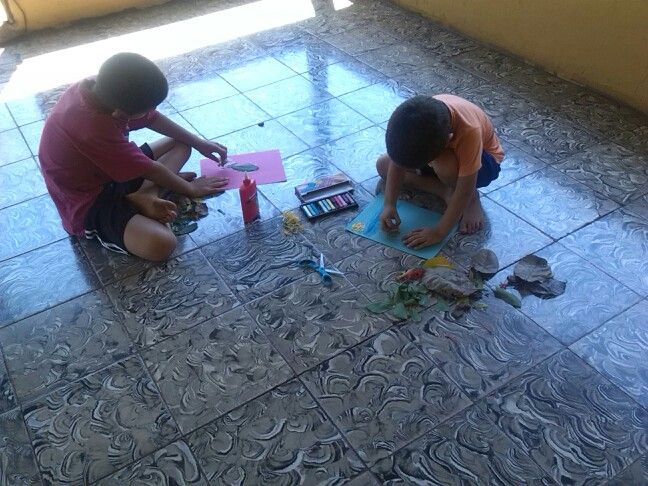
The image size is (648, 486). Identify the location of blue dark blue wavy marble tiles. (277, 422).